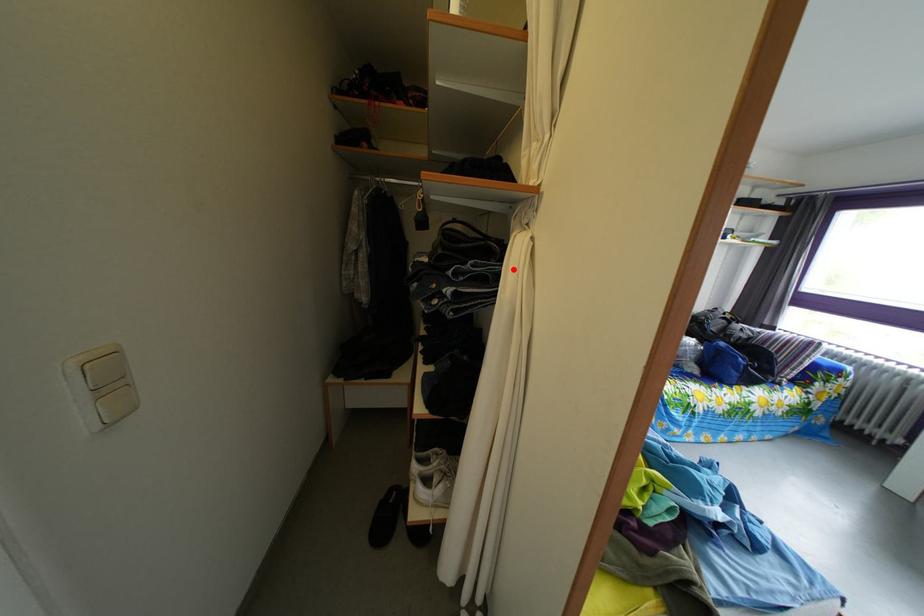
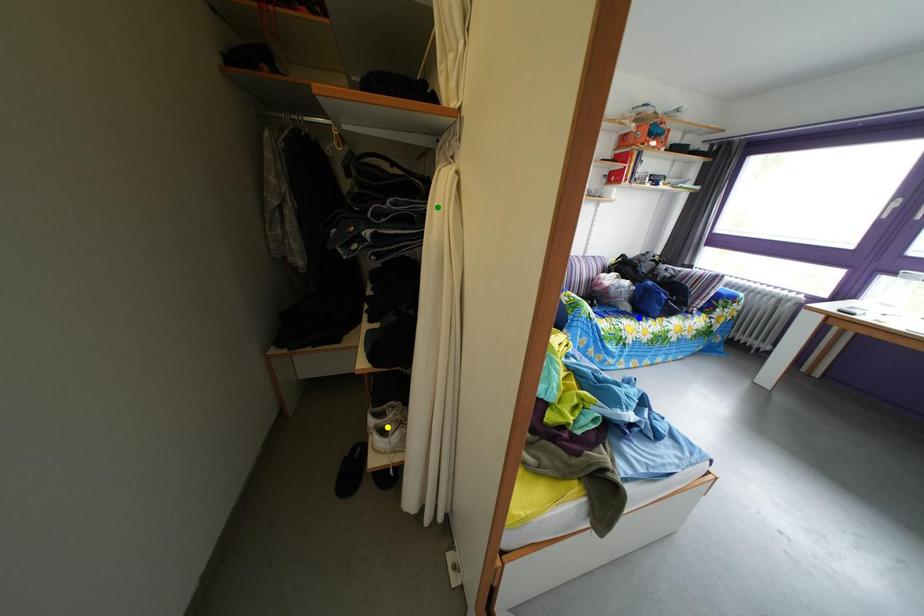
Question: I am providing you with two images of the same scene from different viewpoints. A red point is marked on the first image. You are given multiple points on the second image. Which point in image 2 represents the same 3d spot as the red point in image 1?

Choices:
 (A) green point
 (B) yellow point
 (C) blue point

Answer: (A)